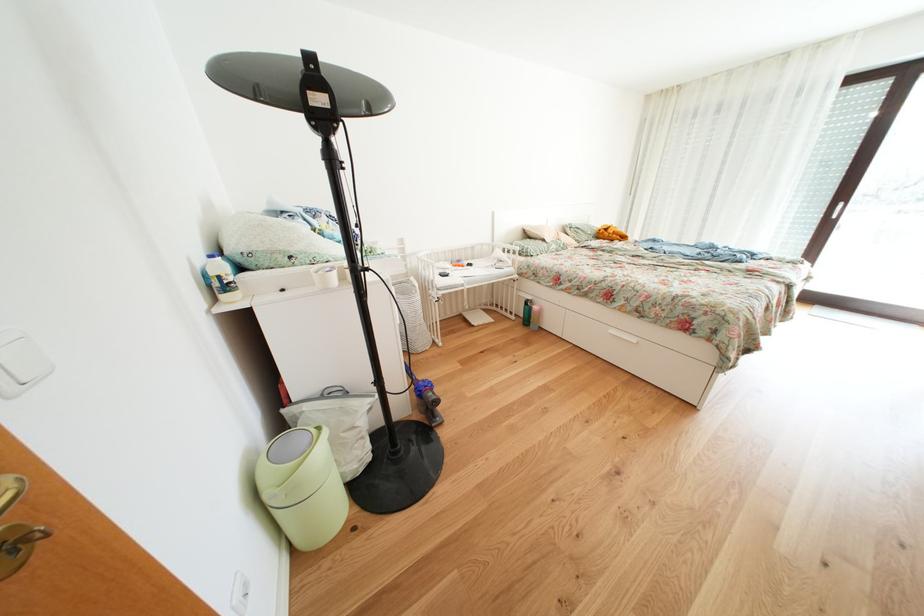
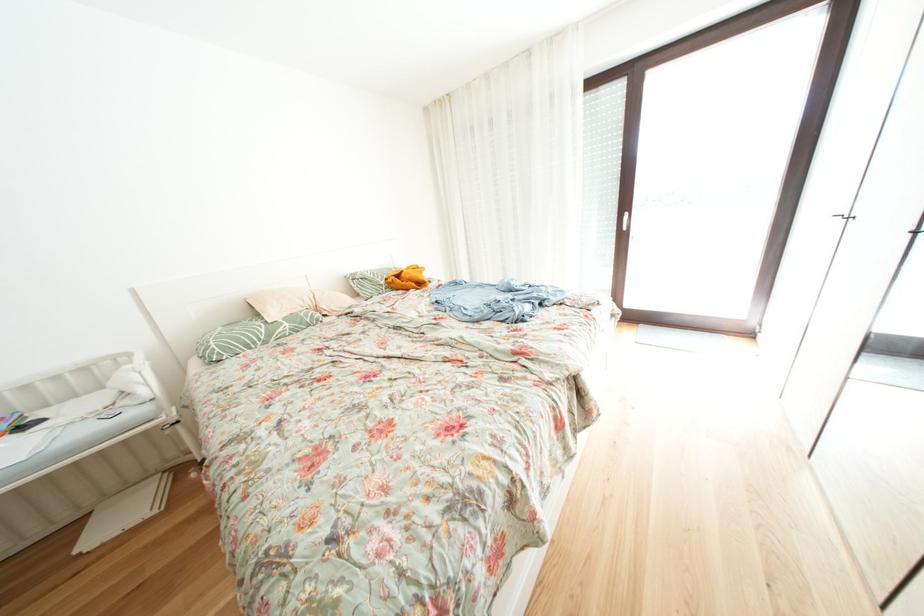
What movement of the cameraman would produce the second image?

The cameraman moved toward right, forward.